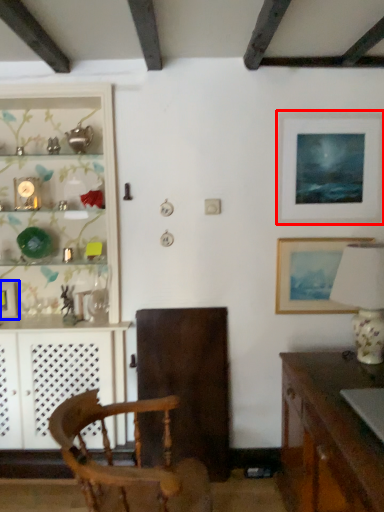
Question: Which point is closer to the camera, picture frame (highlighted by a red box) or picture frame (highlighted by a blue box)?

Choices:
 (A) picture frame
 (B) picture frame

Answer: (A)